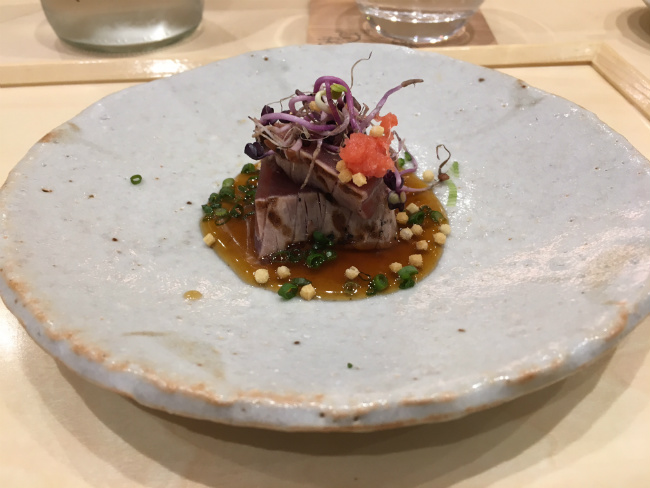
Locate an element on the screen. This screenshot has height=488, width=650. beverage glass is located at coordinates (80, 22), (381, 20).